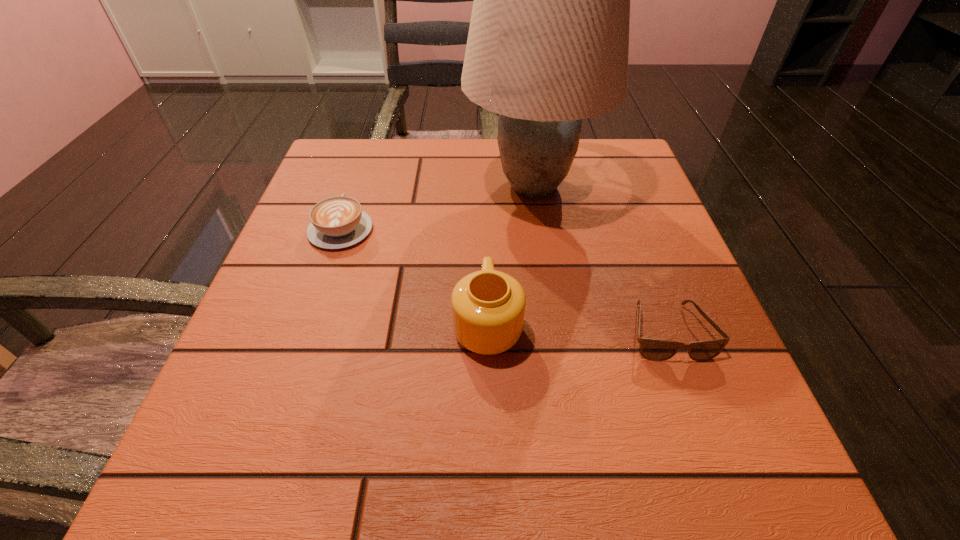
The height and width of the screenshot is (540, 960). I want to click on free area in between the sunglasses and the lampshade, so click(601, 259).

You are a GUI agent. You are given a task and a screenshot of the screen. Output one action in this format:
    pyautogui.click(x=<x>, y=<y>)
    Task: Click on the free space between the tallest object and the cappuccino
    The image size is (960, 540).
    Given the screenshot: What is the action you would take?
    pyautogui.click(x=437, y=207)

Where is `vacant point located between the cappuccino and the tallest object`? vacant point located between the cappuccino and the tallest object is located at coordinates (437, 207).

This screenshot has height=540, width=960. What are the coordinates of `the second closest object to the cappuccino` in the screenshot? It's located at (488, 306).

Identify the location of the second closest object to the mug. The height and width of the screenshot is (540, 960). (652, 349).

Image resolution: width=960 pixels, height=540 pixels. I want to click on vacant space that satisfies the following two spatial constraints: 1. on the side of the cappuccino with the handle; 2. on the left side of the lampshade, so click(355, 186).

This screenshot has height=540, width=960. Find the location of `blank area in the image that satisfies the following two spatial constraints: 1. on the side of the cappuccino with the handle; 2. on the left side of the tallest object`. blank area in the image that satisfies the following two spatial constraints: 1. on the side of the cappuccino with the handle; 2. on the left side of the tallest object is located at coordinates (355, 186).

I want to click on free space that satisfies the following two spatial constraints: 1. on the handle side of the tallest object; 2. on the right side of the second tallest object, so click(486, 186).

Locate an element on the screen. vacant space that satisfies the following two spatial constraints: 1. on the handle side of the tallest object; 2. on the right side of the third shortest object is located at coordinates (486, 186).